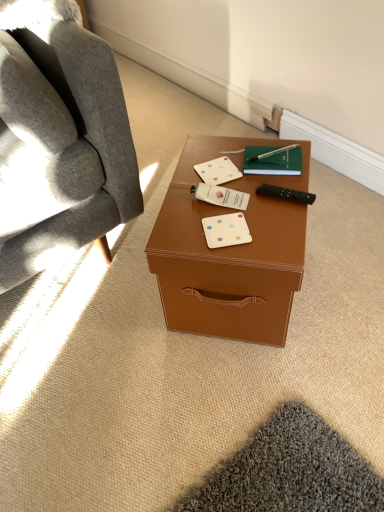
Where is `vacant location behind white matte business card at center, marked as the first business card in a top-to-bottom arrangement`? This screenshot has height=512, width=384. vacant location behind white matte business card at center, marked as the first business card in a top-to-bottom arrangement is located at coordinates (213, 150).